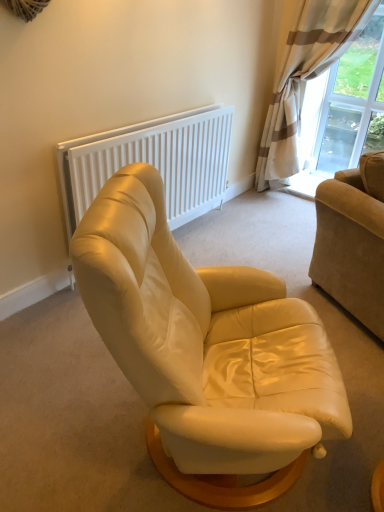
I want to click on free area in between beige striped curtain at upper right and white matte radiator at upper center, so 251,229.